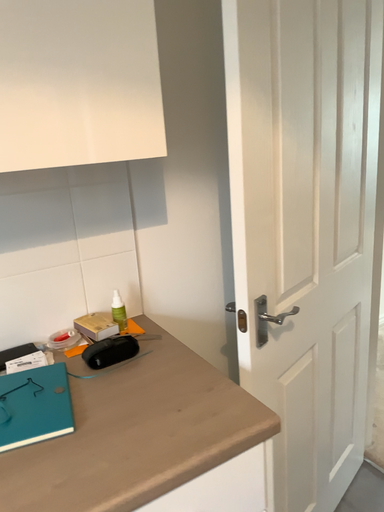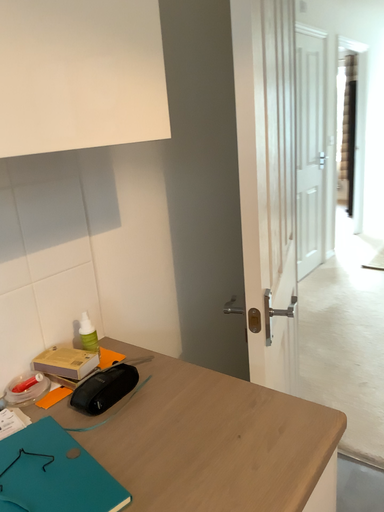
Question: Which way did the camera rotate in the video?

Choices:
 (A) rotated right
 (B) rotated left

Answer: (A)